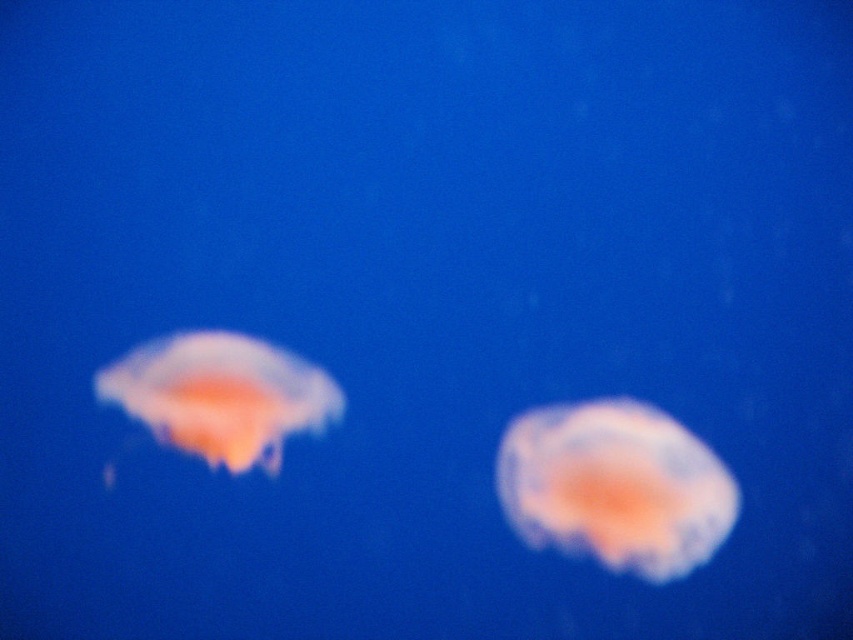
You are observing the scene from a diving mask underwater. There is a translucent orange jellyfish at center. Can you determine its exact coordinates in the image?

The translucent orange jellyfish at center is located at point (614, 486), so yes, its coordinates are precisely known.

Based on the photo, you are a marine biologist observing the scene through a submersible window. The submersible has a viewing port that allows you to see the translucent orange jellyfish at center. If the jellyfish is exactly 1.24 meters away from the camera, can you safely approach it without touching the window? Assume the submersible window is 1.5 meters wide and your arm reaches 0.5 meters beyond the window.

The translucent orange jellyfish at center is 1.24 meters from the camera. Since the submersible window is 1.5 meters wide and your arm can reach 0.5 meters beyond it, you can safely approach the jellyfish without touching the window because the distance to the jellyfish is within your reach range.